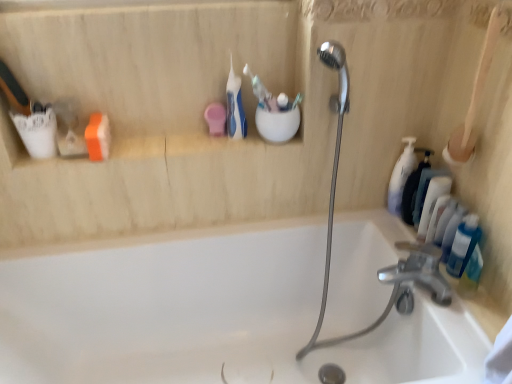
The height and width of the screenshot is (384, 512). I want to click on free spot to the left of white glossy soap dispenser at right, acting as the second toiletry starting from the left, so click(365, 221).